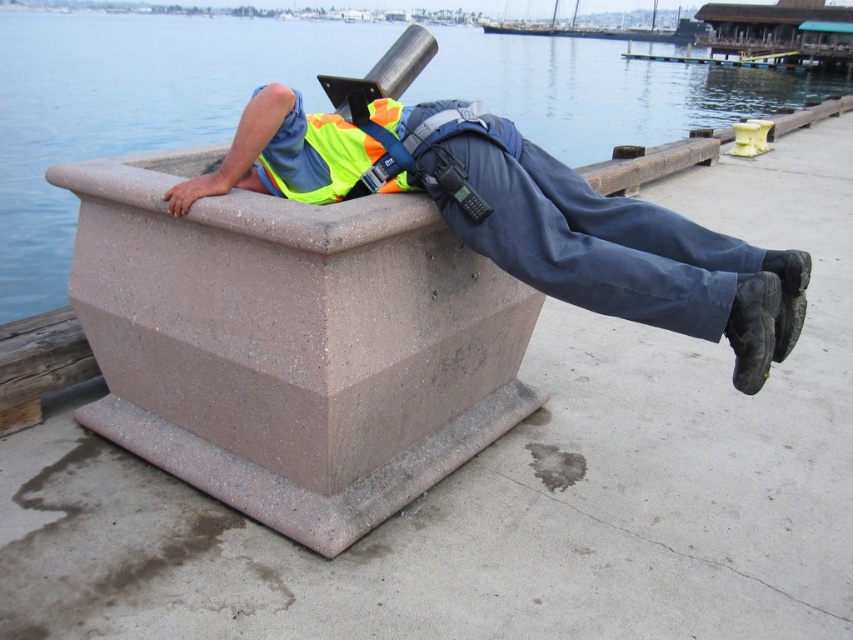
A person is lying on a concrete planter box on a dock. They have a backpack with a walkie talkie. If the person wants to reach the walkie talkie without moving their torso, can they do so? The point where their hand can reach is at point (566,292). The walkie talkie is 2.14 meters away from this point.

The walkie talkie is 2.14 meters away from the point where their hand can reach, so the person cannot reach it without moving their torso.